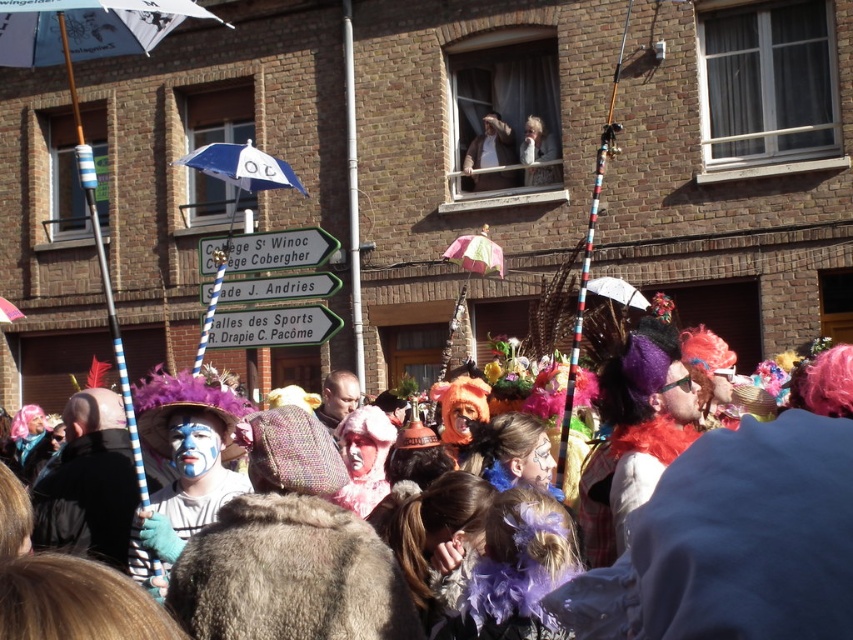
Question: Which is farther from the greensignboard at center?

Choices:
 (A) green plastic street sign at center
 (B) matte white face paint at upper center

Answer: (B)

Question: Can you confirm if green plastic street sign at center is positioned to the right of matte white wig at center?

Choices:
 (A) no
 (B) yes

Answer: (A)

Question: Considering the real-world distances, which object is closest to the green plastic street sign at center?

Choices:
 (A) matte white wig at center
 (B) green plastic street sign at upper center
 (C) matte white face paint at upper center
 (D) greensignboard at center

Answer: (D)

Question: Which of these objects is positioned closest to the light brown leather jacket at upper center?

Choices:
 (A) matte white face paint at upper center
 (B) greensignboard at center
 (C) green plastic street sign at center
 (D) green plastic street sign at upper center

Answer: (A)

Question: Can you confirm if green plastic street sign at upper center is positioned to the right of light brown leather jacket at upper center?

Choices:
 (A) yes
 (B) no

Answer: (B)

Question: Can you confirm if white fabric umbrella at left is thinner than greensignboard at center?

Choices:
 (A) yes
 (B) no

Answer: (B)